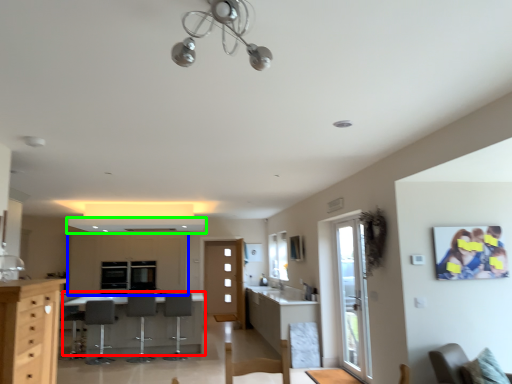
Question: Which object is positioned farthest from table (highlighted by a red box)? Select from cabinetry (highlighted by a blue box) and exhaust hood (highlighted by a green box).

Choices:
 (A) cabinetry
 (B) exhaust hood

Answer: (B)